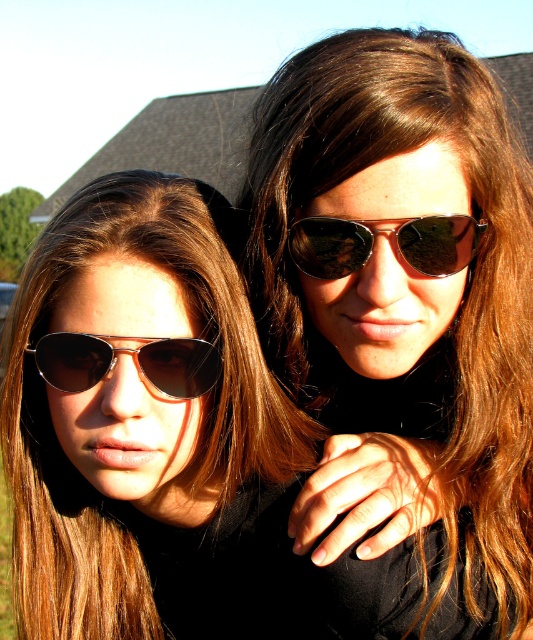
Is brown shiny hair at upper right thinner than brown shiny hair at left?

Yes, brown shiny hair at upper right is thinner than brown shiny hair at left.

Is point (406, 212) farther from camera compared to point (45, 461)?

No.

Locate an element on the screen. This screenshot has height=640, width=533. brown shiny hair at upper right is located at coordinates (406, 305).

Who is shorter, brown shiny hair at left or metallic aviator sunglasses at center?

With less height is metallic aviator sunglasses at center.

I want to click on brown shiny hair at left, so click(x=205, y=426).

Who is more forward, (42, 333) or (165, 337)?

Point (165, 337) is in front.

What are the coordinates of `brown shiny hair at left` in the screenshot? It's located at (205, 426).

Is brown shiny hair at left bigger than shiny orange aviator sunglasses at upper right?

Correct, brown shiny hair at left is larger in size than shiny orange aviator sunglasses at upper right.

Describe the element at coordinates (205, 426) in the screenshot. I see `brown shiny hair at left` at that location.

This screenshot has height=640, width=533. I want to click on brown shiny hair at left, so click(x=205, y=426).